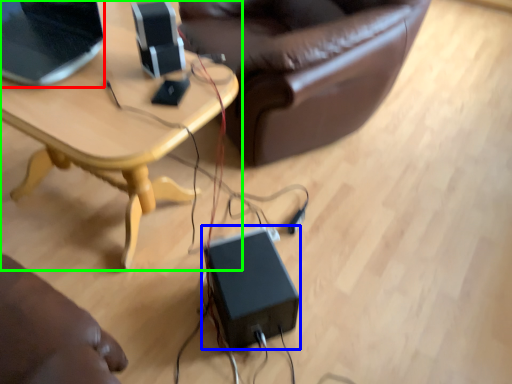
Question: Which object is the closest to the laptop (highlighted by a red box)? Choose among these: speaker (highlighted by a blue box) or table (highlighted by a green box).

Choices:
 (A) speaker
 (B) table

Answer: (B)